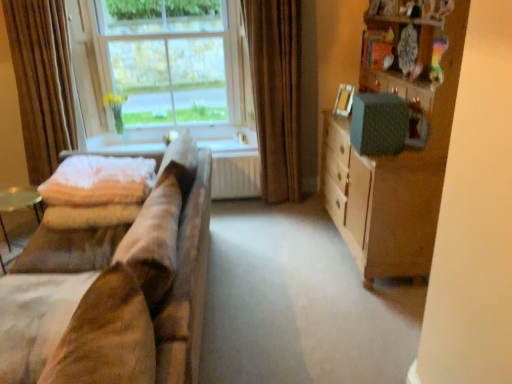
The image size is (512, 384). Identify the location of free space on the front side of wooden cabinet at right. (338, 319).